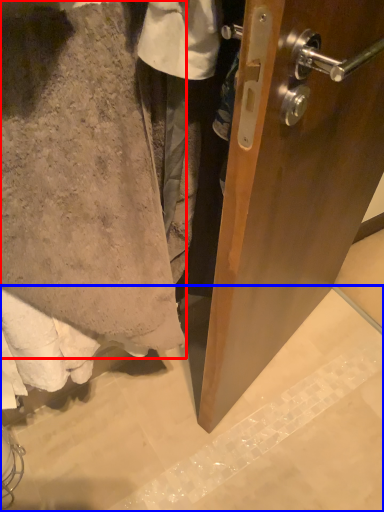
Question: Which of the following is the farthest to the observer, towel (highlighted by a red box) or concrete (highlighted by a blue box)?

Choices:
 (A) towel
 (B) concrete

Answer: (B)